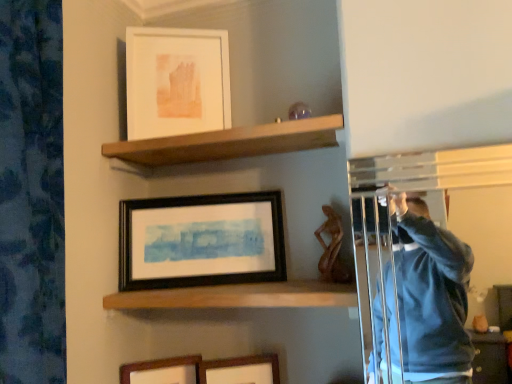
Question: In terms of height, does black matte picture frame at center, the third picture frame in the bottom-to-top sequence, look taller or shorter compared to wooden shelf at upper center, which ranks as the 2th shelf in bottom-to-top order?

Choices:
 (A) tall
 (B) short

Answer: (A)

Question: From a real-world perspective, is black matte picture frame at center, the third picture frame in the bottom-to-top sequence, positioned above or below wooden shelf at upper center, which ranks as the 2th shelf in bottom-to-top order?

Choices:
 (A) below
 (B) above

Answer: (A)

Question: Which object is the closest to the wooden picture frame at lower center, which is the fourth picture frame in top-to-bottom order?

Choices:
 (A) wooden shelf at center, the 1th shelf in the bottom-to-top sequence
 (B) black matte picture frame at center, the third picture frame in the bottom-to-top sequence
 (C) wooden picture frame at lower center, the 3th picture frame from the top
 (D) white matte picture frame at upper center, arranged as the first picture frame when viewed from the top
 (E) wooden shelf at upper center, which is counted as the first shelf, starting from the top

Answer: (C)

Question: Estimate the real-world distances between objects in this image. Which object is farther from the wooden shelf at center, which is the 2th shelf in top-to-bottom order?

Choices:
 (A) black matte picture frame at center, which ranks as the 2th picture frame in top-to-bottom order
 (B) wooden shelf at upper center, which ranks as the 2th shelf in bottom-to-top order
 (C) white matte picture frame at upper center, arranged as the first picture frame when viewed from the top
 (D) wooden picture frame at lower center, the second picture frame from the bottom
 (E) wooden picture frame at lower center, which is the fourth picture frame in top-to-bottom order

Answer: (C)